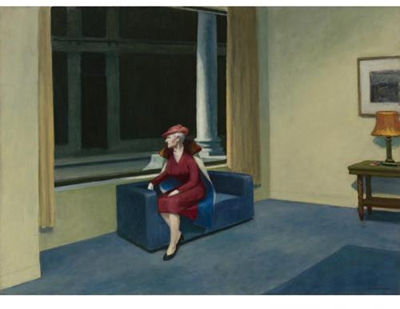
In order to click on lamp in this screenshot , I will do `click(387, 146)`.